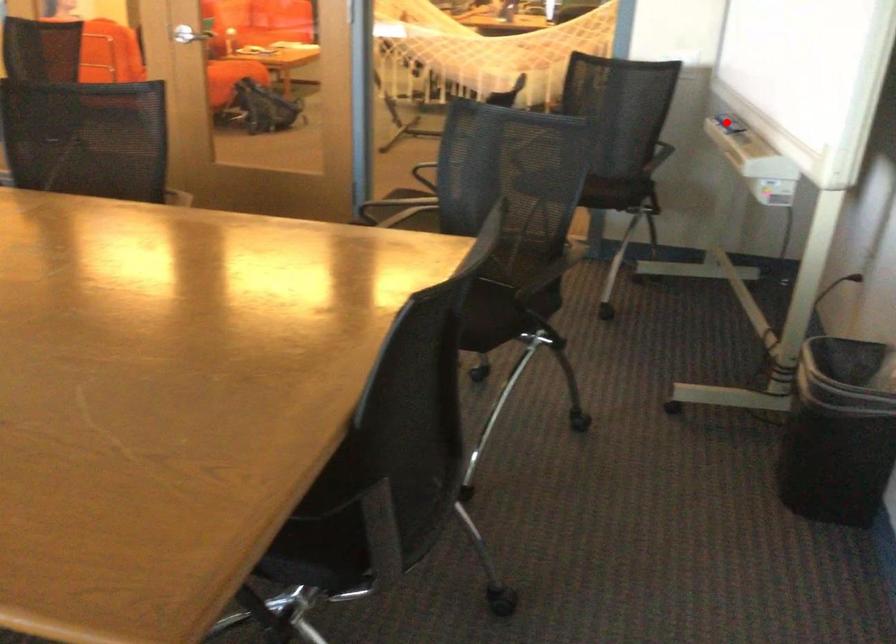
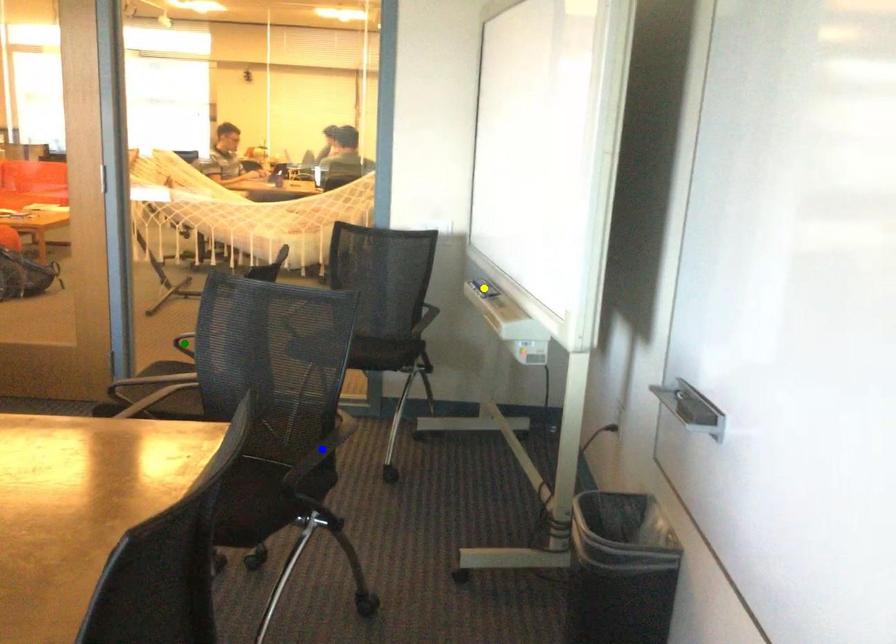
Question: I am providing you with two images of the same scene from different viewpoints. A red point is marked on the first image. You are given multiple points on the second image. In image 2, which mark is for the same physical point as the one in image 1?

Choices:
 (A) blue point
 (B) yellow point
 (C) green point

Answer: (B)